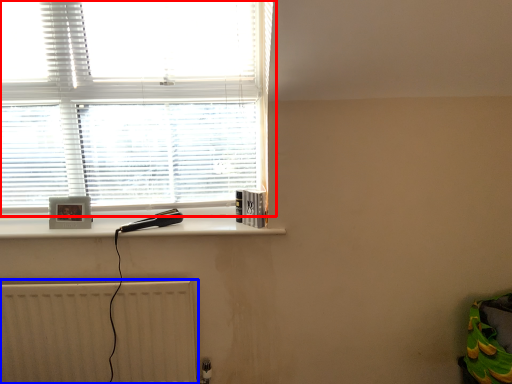
Question: Which object is further to the camera taking this photo, window (highlighted by a red box) or radiator (highlighted by a blue box)?

Choices:
 (A) window
 (B) radiator

Answer: (B)